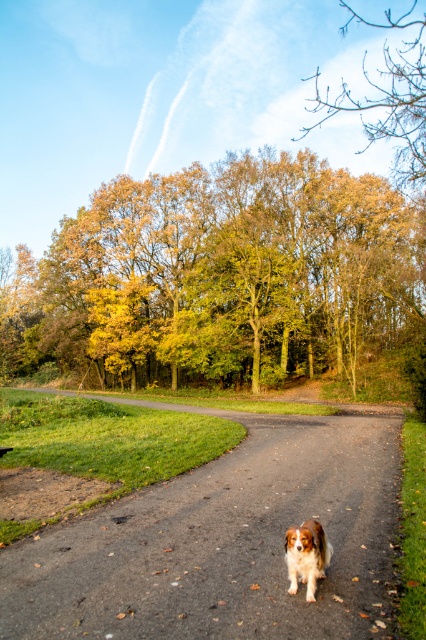
You are a hiker walking along the path and see the asphalt road at center and the brown and white fur dog at center. Which object is located to the right of the dog?

The asphalt road at center is positioned on the right side of the brown and white fur dog at center, so the asphalt road at center is to the right of the dog.